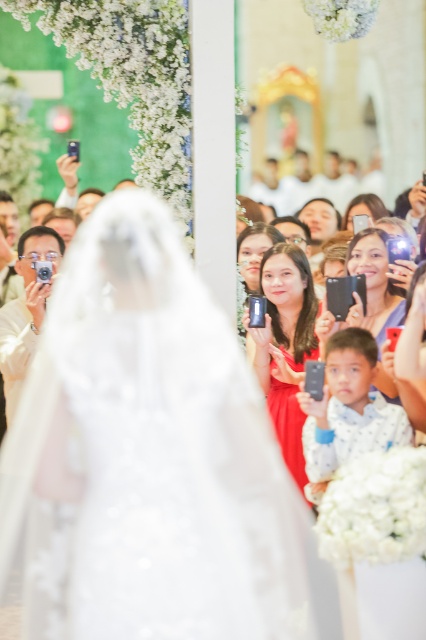
You are a photographer at the wedding. You want to take a photo of the bride without blocking the crowd behind you. The white lace veil at center and the matte silver camera at left are in your way. Which object should you move to get a clear shot?

The white lace veil at center is below the matte silver camera at left. To get a clear shot, you should move the matte silver camera at left since it is above the white lace veil at center and blocking the view first.

You are a photographer at the wedding and need to move your matte silver camera at left closer to the matte black phone at center so that it is only 3 feet away. Is this possible without moving the phone?

The current distance between the matte silver camera at left and the matte black phone at center is 6.77 feet. To reduce the distance to 3 feet, you would need to move the matte silver camera at left closer by 3.77 feet. This adjustment is feasible as long as there is enough space available in the midground area where the crowd is gathered to maneuver the camera without obstructing others or the phone.

Consider the image. You are a photographer at the wedding. You want to take a closeup shot of the white lace veil at center without moving too close. What is the minimum distance you need to maintain to get a clear shot?

The white lace veil at center is 3.81 meters away from the viewer, so you need to maintain at least 3.81 meters distance to capture it clearly.